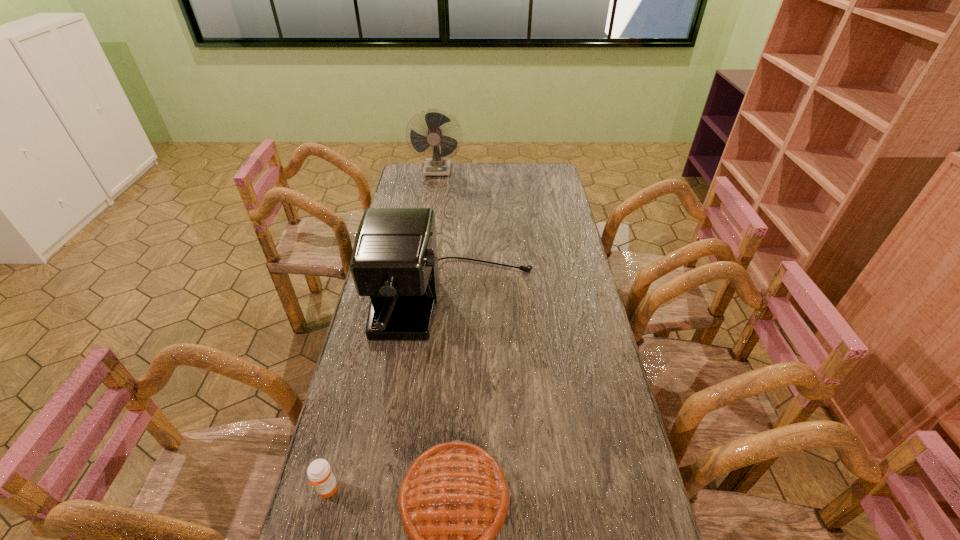
Choose which object is the nearest neighbor to the coffee maker. Please provide its 2D coordinates. Your answer should be formatted as a tuple, i.e. [(x, y)], where the tuple contains the x and y coordinates of a point satisfying the conditions above.

[(453, 501)]